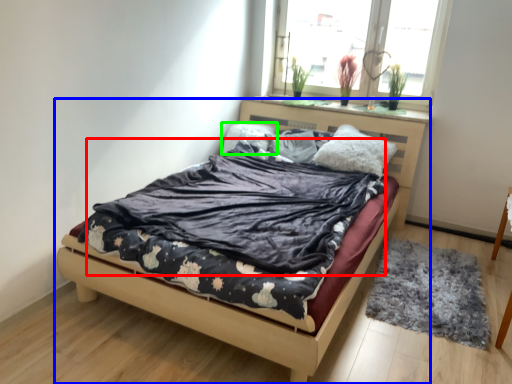
Question: Which object is the closest to the blanket (highlighted by a red box)? Choose among these: bed (highlighted by a blue box) or pillow (highlighted by a green box).

Choices:
 (A) bed
 (B) pillow

Answer: (A)